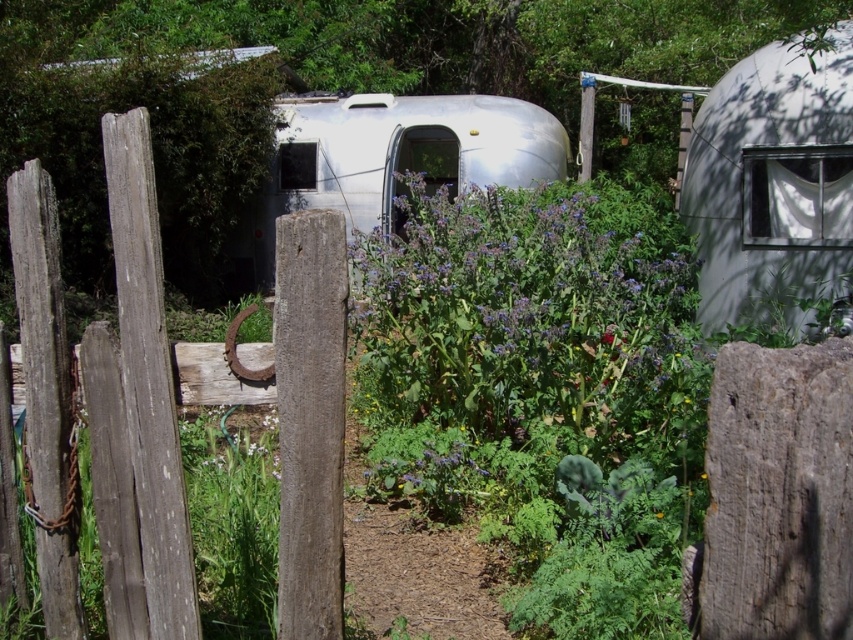
Question: Which object is farther from the camera taking this photo?

Choices:
 (A) weathered wood fence at left
 (B) silver metallic trailer at center

Answer: (B)

Question: Which point is closer to the camera?

Choices:
 (A) (474, 129)
 (B) (283, 456)

Answer: (B)

Question: Does weathered wood fence at left appear under silver metallic trailer at center?

Choices:
 (A) yes
 (B) no

Answer: (A)

Question: Is weathered wood fence at left to the right of silver metallic trailer at center from the viewer's perspective?

Choices:
 (A) no
 (B) yes

Answer: (A)

Question: Can you confirm if weathered wood fence at left is positioned above silver metallic trailer at center?

Choices:
 (A) no
 (B) yes

Answer: (A)